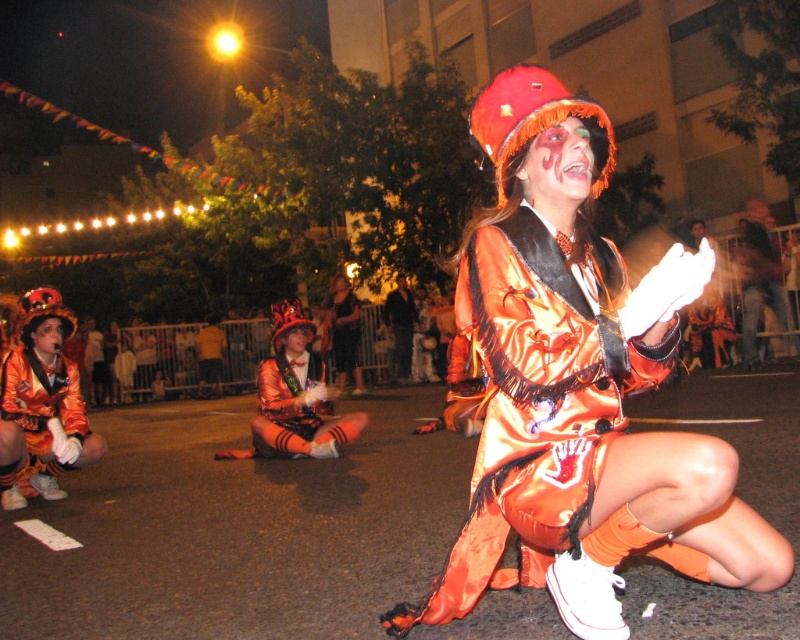
Question: Is matte orange satin costume at lower left to the left of satin/velvet costume at center from the viewer's perspective?

Choices:
 (A) yes
 (B) no

Answer: (A)

Question: Which point is closer to the camera?

Choices:
 (A) (306, 433)
 (B) (16, 364)
 (C) (346, 358)
 (D) (562, 534)

Answer: (D)

Question: Among these points, which one is farthest from the camera?

Choices:
 (A) (73, 460)
 (B) (314, 428)

Answer: (B)

Question: Does matte orange satin costume at lower left have a larger size compared to satin/velvet costume at center?

Choices:
 (A) no
 (B) yes

Answer: (A)

Question: Which is nearer to the satin/velvet jacket at center?

Choices:
 (A) matte orange satin costume at lower left
 (B) satin/velvet costume at center
 (C) satin/velvet shorts at center

Answer: (A)

Question: Is satin/velvet shorts at center thinner than matte orange satin costume at lower left?

Choices:
 (A) yes
 (B) no

Answer: (B)